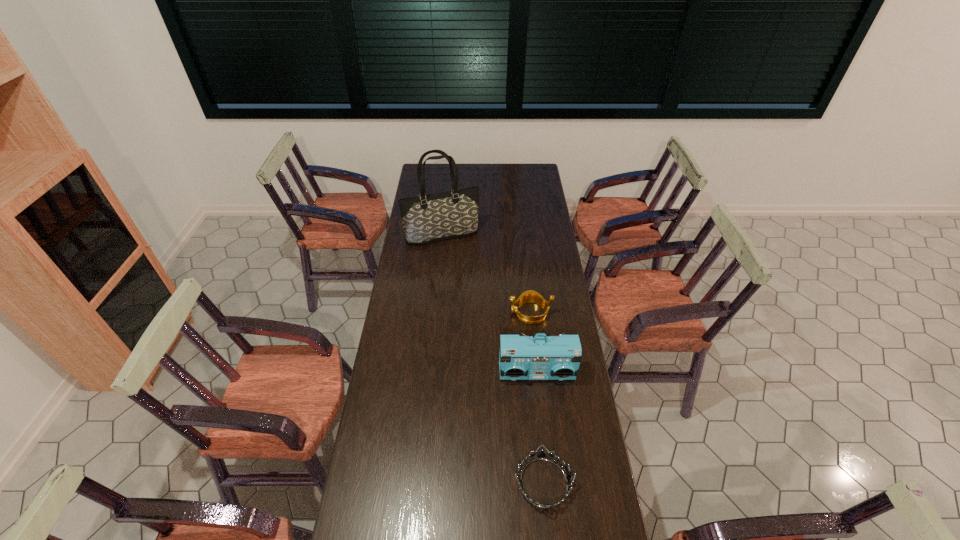
You are a GUI agent. You are given a task and a screenshot of the screen. Output one action in this format:
    pyautogui.click(x=<x>, y=<y>)
    Task: Click on the free space at the right edge
    
    Given the screenshot: What is the action you would take?
    pyautogui.click(x=561, y=520)

This screenshot has height=540, width=960. What are the coordinates of `free location at the far left corner of the desktop` in the screenshot? It's located at (436, 176).

The image size is (960, 540). In the image, there is a desktop. In order to click on free space at the far right corner in this screenshot , I will do 536,169.

Find the location of a particular element. This screenshot has height=540, width=960. free space that is in between the second tallest object and the nearest object is located at coordinates (540, 428).

At what (x,y) coordinates should I click in order to perform the action: click on unoccupied position between the nearer tiara and the tallest object. Please return your answer as a coordinate pair (x, y). The width and height of the screenshot is (960, 540). Looking at the image, I should click on (492, 359).

Image resolution: width=960 pixels, height=540 pixels. Find the location of `free space between the shorter tiara and the farthest object`. free space between the shorter tiara and the farthest object is located at coordinates (492, 359).

In order to click on unoccupied position between the farther tiara and the nearest object in this screenshot , I will do `click(537, 397)`.

Locate an element on the screen. Image resolution: width=960 pixels, height=540 pixels. free point between the nearer tiara and the second tallest object is located at coordinates (540, 428).

This screenshot has width=960, height=540. I want to click on empty location between the third farthest object and the leftmost object, so click(490, 305).

The height and width of the screenshot is (540, 960). Identify the location of empty location between the nearer tiara and the radio receiver. (540, 428).